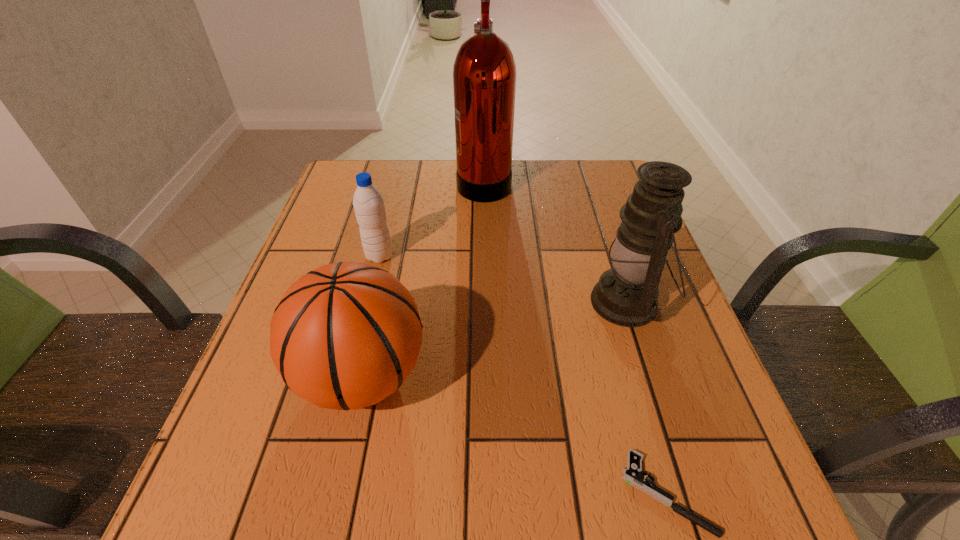
Find the location of a particular element. This screenshot has height=540, width=960. the third object from right to left is located at coordinates (484, 72).

Locate an element on the screen. Image resolution: width=960 pixels, height=540 pixels. the farthest object is located at coordinates (484, 72).

The height and width of the screenshot is (540, 960). I want to click on the fourth shortest object, so click(x=626, y=295).

At what (x,y) coordinates should I click in order to perform the action: click on basketball. Please return your answer as a coordinate pair (x, y). Image resolution: width=960 pixels, height=540 pixels. Looking at the image, I should click on point(346,335).

At what (x,y) coordinates should I click in order to perform the action: click on the second farthest object. Please return your answer as a coordinate pair (x, y). This screenshot has height=540, width=960. Looking at the image, I should click on (368, 203).

This screenshot has width=960, height=540. I want to click on the shortest object, so click(632, 475).

This screenshot has width=960, height=540. In order to click on the nearest object in this screenshot , I will do `click(632, 475)`.

Locate an element on the screen. This screenshot has height=540, width=960. vacant area situated on the front-facing side of the third object from right to left is located at coordinates (421, 181).

The height and width of the screenshot is (540, 960). What are the coordinates of `free point located on the front-facing side of the third object from right to left` in the screenshot? It's located at (428, 181).

At what (x,y) coordinates should I click in order to perform the action: click on vacant region located 0.190m on the front-facing side of the third object from right to left. Please return your answer as a coordinate pair (x, y). Looking at the image, I should click on point(390,181).